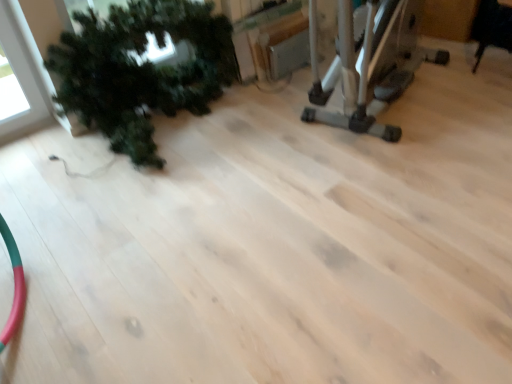
Question: Is point (493, 31) closer or farther from the camera than point (412, 52)?

Choices:
 (A) farther
 (B) closer

Answer: (A)

Question: From their relative heights in the image, would you say black leather chair at upper right is taller or shorter than silver metallic elliptical trainer at upper right?

Choices:
 (A) tall
 (B) short

Answer: (B)

Question: Which object is the farthest from the silver metallic elliptical trainer at upper right?

Choices:
 (A) green matte plant at left
 (B) black leather chair at upper right

Answer: (A)

Question: Estimate the real-world distances between objects in this image. Which object is closer to the green matte plant at left?

Choices:
 (A) black leather chair at upper right
 (B) silver metallic elliptical trainer at upper right

Answer: (B)